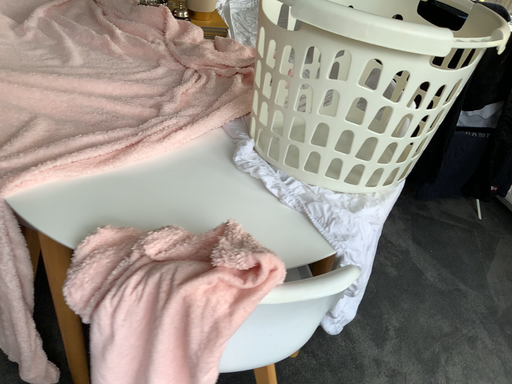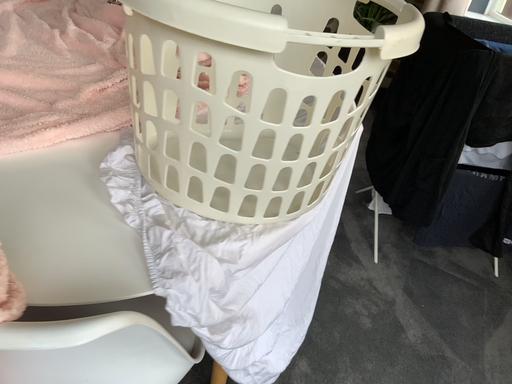
Question: How did the camera likely rotate when shooting the video?

Choices:
 (A) rotated left
 (B) rotated right

Answer: (A)